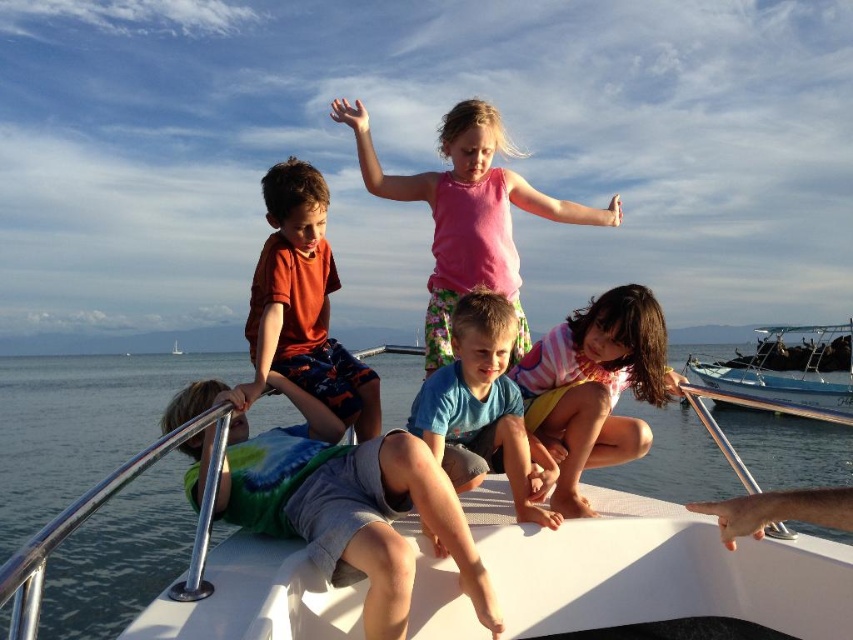
Consider the image. Can you confirm if green tie-dye shirt at center is positioned below white plastic boat at right?

No, green tie-dye shirt at center is not below white plastic boat at right.

Does green tie-dye shirt at center have a larger size compared to white plastic boat at right?

Incorrect, green tie-dye shirt at center is not larger than white plastic boat at right.

The height and width of the screenshot is (640, 853). In order to click on green tie-dye shirt at center in this screenshot , I will do `click(340, 500)`.

Is point (646, 380) in front of point (175, 340)?

Yes.

Can you confirm if pink striped shirt at center is bigger than white plastic boat at center?

Indeed, pink striped shirt at center has a larger size compared to white plastic boat at center.

Which is in front, point (585, 392) or point (177, 353)?

Point (585, 392) is in front.

At what (x,y) coordinates should I click in order to perform the action: click on pink striped shirt at center. Please return your answer as a coordinate pair (x, y). The image size is (853, 640). Looking at the image, I should click on (595, 387).

Who is lower down, pink fabric dress at center or white plastic boat at center?

white plastic boat at center is below.

Does pink fabric dress at center appear on the left side of white plastic boat at center?

Incorrect, pink fabric dress at center is not on the left side of white plastic boat at center.

The height and width of the screenshot is (640, 853). Identify the location of pink fabric dress at center. (465, 209).